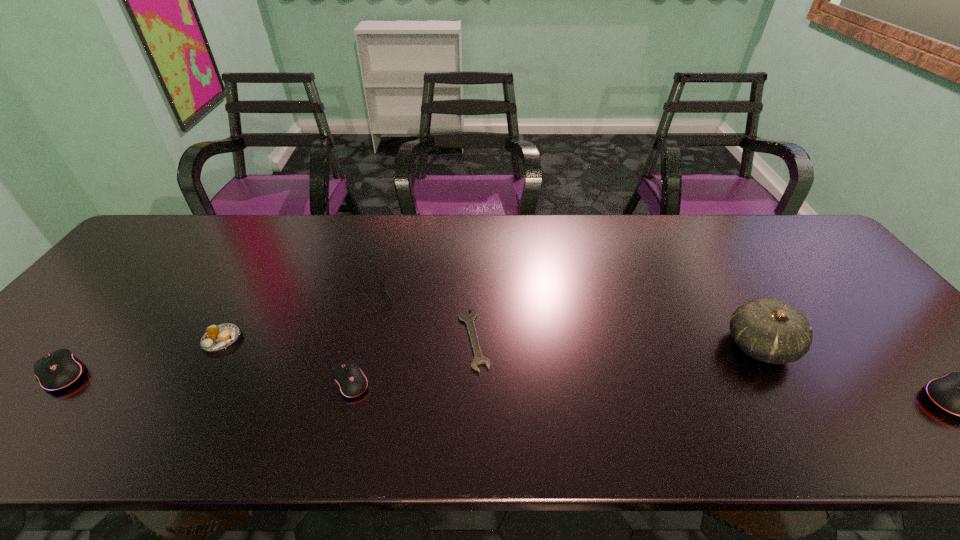
At what (x,y) coordinates should I click in order to perform the action: click on the leftmost computer mouse. Please return your answer as a coordinate pair (x, y). Looking at the image, I should click on (58, 370).

You are a GUI agent. You are given a task and a screenshot of the screen. Output one action in this format:
    pyautogui.click(x=<x>, y=<y>)
    Task: Click on the fifth shortest object
    The image size is (960, 540).
    Given the screenshot: What is the action you would take?
    pyautogui.click(x=58, y=370)

Locate an element on the screen. This screenshot has height=540, width=960. the second computer mouse from left to right is located at coordinates (351, 381).

Find the location of a particular element. the second object from left to right is located at coordinates (219, 337).

Locate an element on the screen. The image size is (960, 540). pastry is located at coordinates (219, 337).

The width and height of the screenshot is (960, 540). Identify the location of the shortest object. (469, 319).

This screenshot has height=540, width=960. I want to click on wrench, so click(469, 319).

You are a GUI agent. You are given a task and a screenshot of the screen. Output one action in this format:
    pyautogui.click(x=<x>, y=<y>)
    Task: Click on the spectacles
    This screenshot has height=540, width=960.
    Given the screenshot: What is the action you would take?
    pyautogui.click(x=388, y=296)

Where is `the sixth object from left to right`? the sixth object from left to right is located at coordinates (767, 329).

At what (x,y) coordinates should I click in order to perform the action: click on the tallest object. Please return your answer as a coordinate pair (x, y). This screenshot has height=540, width=960. Looking at the image, I should click on (767, 329).